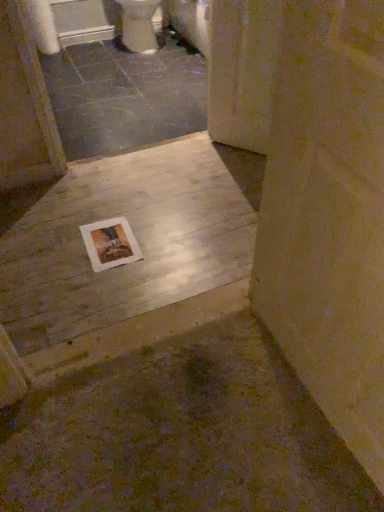
Question: Does white glossy toilet at upper center have a lesser height compared to white paper at center?

Choices:
 (A) yes
 (B) no

Answer: (B)

Question: Can we say white glossy toilet at upper center lies outside white paper at center?

Choices:
 (A) yes
 (B) no

Answer: (A)

Question: Considering the relative sizes of white glossy toilet at upper center and white paper at center in the image provided, is white glossy toilet at upper center bigger than white paper at center?

Choices:
 (A) yes
 (B) no

Answer: (A)

Question: Considering the relative sizes of white glossy toilet at upper center and white paper at center in the image provided, is white glossy toilet at upper center wider than white paper at center?

Choices:
 (A) no
 (B) yes

Answer: (B)

Question: Is white glossy toilet at upper center to the right of white paper at center from the viewer's perspective?

Choices:
 (A) no
 (B) yes

Answer: (A)

Question: Is the position of white glossy toilet at upper center more distant than that of white paper at center?

Choices:
 (A) yes
 (B) no

Answer: (A)

Question: Is white paper at center next to smooth gray concrete at center, which is the 2th concrete in bottom-to-top order?

Choices:
 (A) no
 (B) yes

Answer: (A)

Question: From the image's perspective, would you say white paper at center is shown under smooth gray concrete at center, which is counted as the second concrete, starting from the front?

Choices:
 (A) no
 (B) yes

Answer: (B)

Question: Does white paper at center have a larger size compared to smooth gray concrete at center, which is the 2th concrete in bottom-to-top order?

Choices:
 (A) no
 (B) yes

Answer: (A)

Question: Does white paper at center have a lesser width compared to smooth gray concrete at center, the 1th concrete when ordered from top to bottom?

Choices:
 (A) no
 (B) yes

Answer: (B)

Question: From the image's perspective, would you say white paper at center is positioned over smooth gray concrete at center, the 1th concrete when ordered from top to bottom?

Choices:
 (A) yes
 (B) no

Answer: (B)

Question: Can you confirm if white paper at center is smaller than smooth gray concrete at center, which is counted as the second concrete, starting from the front?

Choices:
 (A) no
 (B) yes

Answer: (B)

Question: Does wooden floor at center, the 2th concrete viewed from the top, have a greater width compared to white glossy toilet at upper center?

Choices:
 (A) no
 (B) yes

Answer: (B)